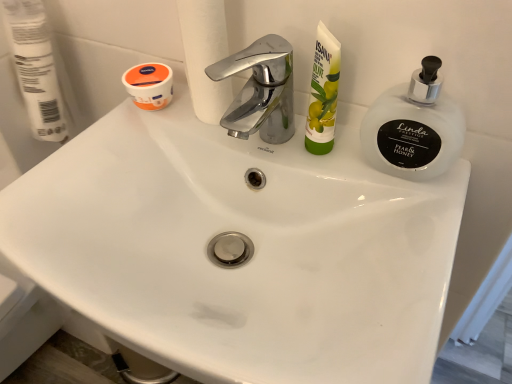
Question: From the image's perspective, is white matte toilet paper at upper left, which is counted as the first toilet paper, starting from the left, above white matte toilet paper at upper center, the second toilet paper positioned from the left?

Choices:
 (A) no
 (B) yes

Answer: (B)

Question: Can you confirm if white matte toilet paper at upper left, placed as the 2th toilet paper when sorted from right to left, is thinner than white matte toilet paper at upper center, which ranks as the 1th toilet paper in right-to-left order?

Choices:
 (A) yes
 (B) no

Answer: (B)

Question: Does white matte toilet paper at upper left, placed as the 2th toilet paper when sorted from right to left, contain white matte toilet paper at upper center, which ranks as the 1th toilet paper in right-to-left order?

Choices:
 (A) yes
 (B) no

Answer: (B)

Question: Can you confirm if white matte toilet paper at upper left, which is counted as the first toilet paper, starting from the left, is bigger than white matte toilet paper at upper center, which ranks as the 1th toilet paper in right-to-left order?

Choices:
 (A) yes
 (B) no

Answer: (A)

Question: Is the surface of white matte toilet paper at upper left, placed as the 2th toilet paper when sorted from right to left, in direct contact with white matte toilet paper at upper center, the second toilet paper positioned from the left?

Choices:
 (A) no
 (B) yes

Answer: (A)

Question: Visually, is green matte tube at upper right positioned to the left or to the right of frosted glass soap dispenser at upper right?

Choices:
 (A) right
 (B) left

Answer: (B)

Question: Is green matte tube at upper right in front of or behind frosted glass soap dispenser at upper right in the image?

Choices:
 (A) front
 (B) behind

Answer: (B)

Question: Based on their sizes in the image, would you say green matte tube at upper right is bigger or smaller than frosted glass soap dispenser at upper right?

Choices:
 (A) big
 (B) small

Answer: (B)

Question: Does point (332, 117) appear closer or farther from the camera than point (451, 135)?

Choices:
 (A) closer
 (B) farther

Answer: (B)

Question: Based on their sizes in the image, would you say orange matte jar at upper left is bigger or smaller than green matte tube at upper right?

Choices:
 (A) big
 (B) small

Answer: (A)

Question: Considering the positions of orange matte jar at upper left and green matte tube at upper right in the image, is orange matte jar at upper left taller or shorter than green matte tube at upper right?

Choices:
 (A) tall
 (B) short

Answer: (B)

Question: Does point (131, 71) appear closer or farther from the camera than point (322, 79)?

Choices:
 (A) farther
 (B) closer

Answer: (A)

Question: From the image's perspective, is orange matte jar at upper left above or below green matte tube at upper right?

Choices:
 (A) below
 (B) above

Answer: (B)

Question: From the image's perspective, relative to white matte toilet paper at upper center, which ranks as the 1th toilet paper in right-to-left order, is frosted glass soap dispenser at upper right above or below?

Choices:
 (A) below
 (B) above

Answer: (A)

Question: Is frosted glass soap dispenser at upper right to the left or to the right of white matte toilet paper at upper center, the second toilet paper positioned from the left, in the image?

Choices:
 (A) right
 (B) left

Answer: (A)